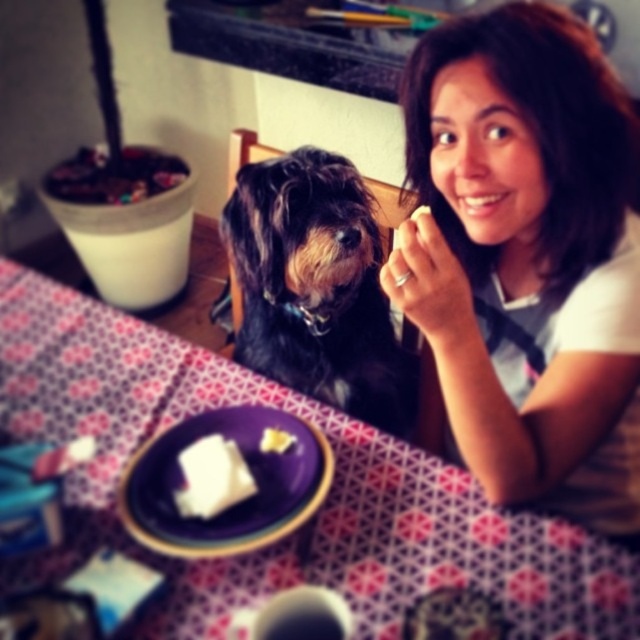
Which is in front, point (296, 314) or point (205, 442)?

Positioned in front is point (205, 442).

Does shiny black fur at center appear on the right side of white soft cheese at center?

Correct, you'll find shiny black fur at center to the right of white soft cheese at center.

The height and width of the screenshot is (640, 640). What are the coordinates of `shiny black fur at center` in the screenshot? It's located at (316, 288).

Locate an element on the screen. This screenshot has height=640, width=640. shiny black fur at center is located at coordinates (316, 288).

Is point (208, 513) more distant than point (269, 435)?

No, it is in front of (269, 435).

Measure the distance between point (237, 477) and camera.

A distance of 30.48 inches exists between point (237, 477) and camera.

The image size is (640, 640). Describe the element at coordinates (211, 477) in the screenshot. I see `white soft cheese at center` at that location.

Where is `white soft cheese at center`? This screenshot has width=640, height=640. white soft cheese at center is located at coordinates (211, 477).

Between point (472, 301) and point (269, 445), which one is positioned behind?

The point (472, 301) is more distant.

Does point (438, 144) come farther from viewer compared to point (268, 429)?

That is False.

Where is `white cotton shirt at upper right`? The height and width of the screenshot is (640, 640). white cotton shirt at upper right is located at coordinates (528, 257).